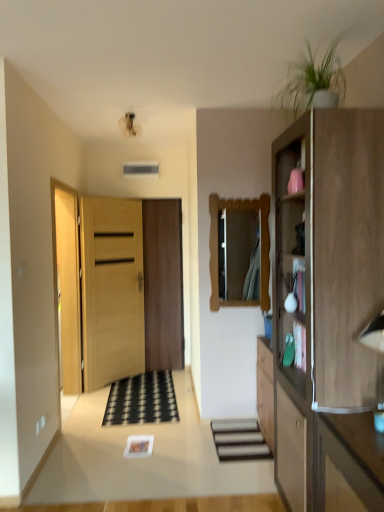
Identify the location of vacant space in front of wooden door at center, the second door from the front. Image resolution: width=384 pixels, height=512 pixels. (152, 382).